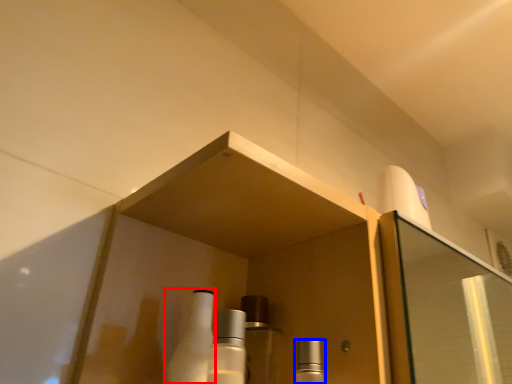
Question: Among these objects, which one is farthest to the camera, bottle (highlighted by a red box) or mouthwash (highlighted by a blue box)?

Choices:
 (A) bottle
 (B) mouthwash

Answer: (A)